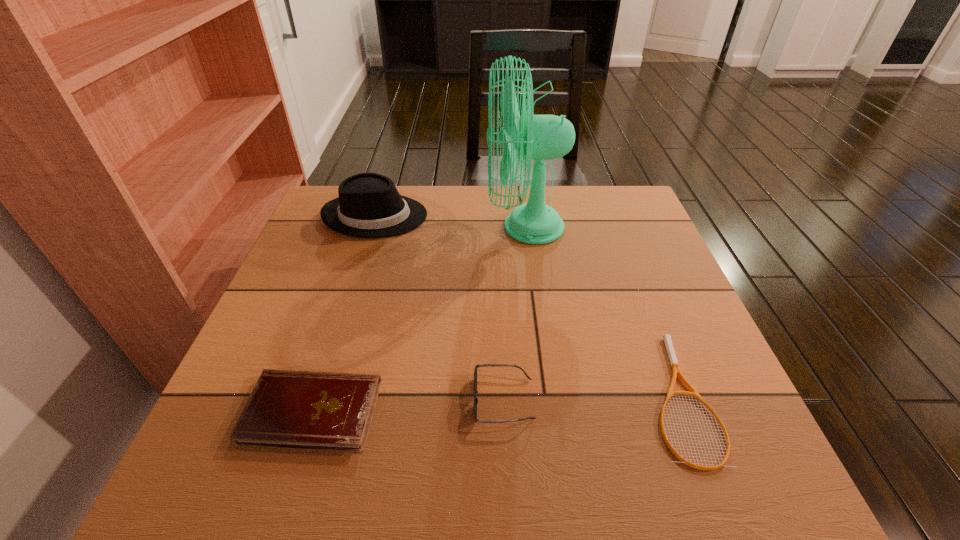
Where is `empty location between the notebook and the sunglasses`? The image size is (960, 540). empty location between the notebook and the sunglasses is located at coordinates (408, 406).

Where is `object that is the fourth closest to the rightmost object`? The width and height of the screenshot is (960, 540). object that is the fourth closest to the rightmost object is located at coordinates (369, 205).

Point out which object is positioned as the second nearest to the tallest object. Please provide its 2D coordinates. Your answer should be formatted as a tuple, i.e. [(x, y)], where the tuple contains the x and y coordinates of a point satisfying the conditions above.

[(676, 370)]

Locate an element on the screen. free location that satisfies the following two spatial constraints: 1. on the front-facing side of the fedora; 2. on the back side of the tennis racket is located at coordinates (319, 396).

This screenshot has height=540, width=960. What are the coordinates of `free point that satisfies the following two spatial constraints: 1. on the front-facing side of the fourth shortest object; 2. on the front side of the notebook` in the screenshot? It's located at (315, 411).

The height and width of the screenshot is (540, 960). In order to click on free space that satisfies the following two spatial constraints: 1. on the front-facing side of the fedora; 2. on the back side of the tennis racket in this screenshot , I will do `click(319, 396)`.

You are a GUI agent. You are given a task and a screenshot of the screen. Output one action in this format:
    pyautogui.click(x=<x>, y=<y>)
    Task: Click on the free space that satisfies the following two spatial constraints: 1. on the front-facing side of the tennis racket; 2. on the left side of the fedora
    The height and width of the screenshot is (540, 960).
    Given the screenshot: What is the action you would take?
    pyautogui.click(x=319, y=396)

Find the location of `vacant position in the image that satisfies the following two spatial constraints: 1. on the front-facing side of the fedora; 2. on the left side of the rightmost object`. vacant position in the image that satisfies the following two spatial constraints: 1. on the front-facing side of the fedora; 2. on the left side of the rightmost object is located at coordinates (319, 396).

Find the location of a particular element. This screenshot has width=960, height=540. free space that satisfies the following two spatial constraints: 1. in front of the tallest object to blow air; 2. on the left side of the shortest object is located at coordinates (546, 396).